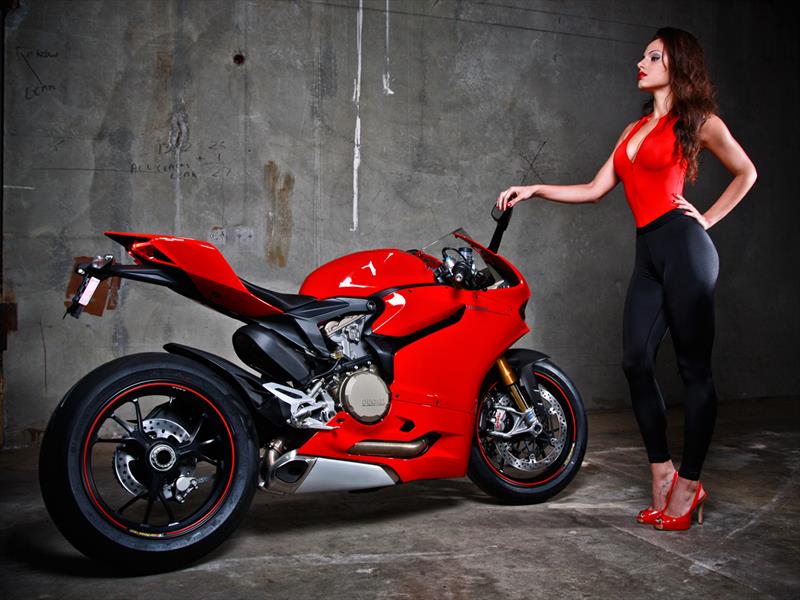
The width and height of the screenshot is (800, 600). I want to click on handle, so click(x=460, y=280).